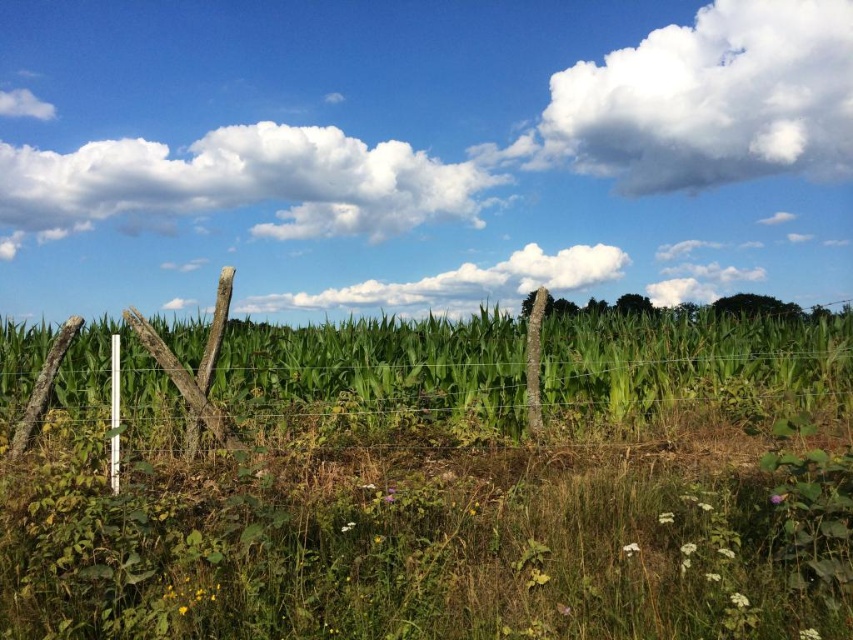
You are a gardener trying to determine which plant in the center is more suitable for a small garden space. Based on the scene, which one between the green grass at center and the green leafy corn at center would you recommend?

The green grass at center is thinner than the green leafy corn at center, so it would be more suitable for a small garden space as it requires less space to grow.